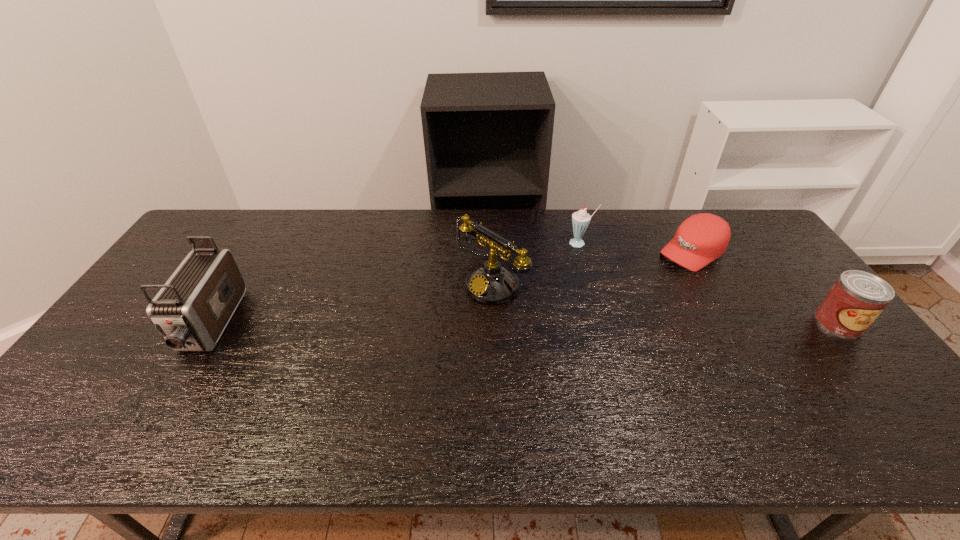
I want to click on free space located 0.180m on the straw side of the milkshake, so click(540, 273).

Locate an element on the screen. This screenshot has width=960, height=540. free spot located 0.280m on the straw side of the milkshake is located at coordinates (518, 288).

Locate an element on the screen. free location located 0.320m on the front-facing side of the cap is located at coordinates (604, 308).

What are the coordinates of `free space located 0.380m on the front-facing side of the cap` in the screenshot? It's located at (589, 317).

Identify the location of free point located 0.250m on the front-facing side of the cap. The image size is (960, 540). (620, 298).

Where is `free space located 0.230m on the dial of the fourth object from right to left`? This screenshot has height=540, width=960. free space located 0.230m on the dial of the fourth object from right to left is located at coordinates (402, 346).

You are a GUI agent. You are given a task and a screenshot of the screen. Output one action in this format:
    pyautogui.click(x=<x>, y=<y>)
    Task: Click on the vacant space situated on the dial of the fourth object from right to left
    This screenshot has width=960, height=540.
    Given the screenshot: What is the action you would take?
    pyautogui.click(x=428, y=328)

Locate an element on the screen. The width and height of the screenshot is (960, 540). vacant space located 0.060m on the dial of the fourth object from right to left is located at coordinates (450, 313).

Where is `milkshake that is at the far edge`? Image resolution: width=960 pixels, height=540 pixels. milkshake that is at the far edge is located at coordinates (580, 220).

Locate an element on the screen. This screenshot has height=540, width=960. cap that is at the far edge is located at coordinates (700, 239).